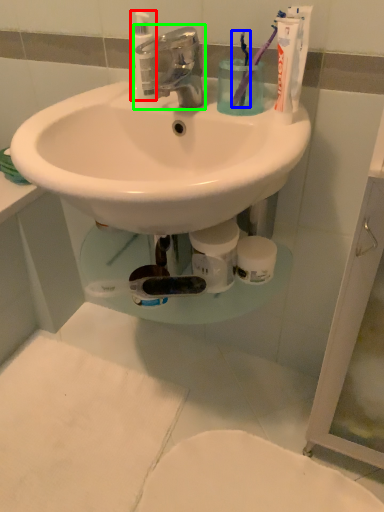
Question: Based on their relative distances, which object is farther from cleaning product (highlighted by a red box)? Choose from toothbrush (highlighted by a blue box) and tap (highlighted by a green box).

Choices:
 (A) toothbrush
 (B) tap

Answer: (A)